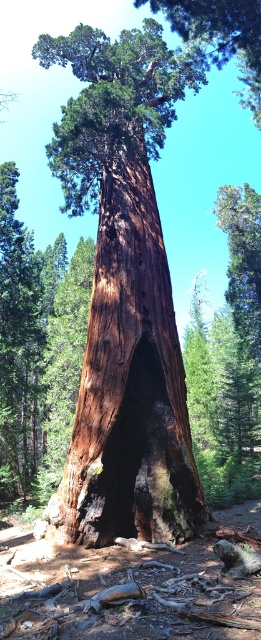
Between brown rough bark at center and smooth brown bark at upper center, which one is positioned higher?

smooth brown bark at upper center

Measure the distance between point (108, 400) and camera.

A distance of 7.70 meters exists between point (108, 400) and camera.

You are a GUI agent. You are given a task and a screenshot of the screen. Output one action in this format:
    pyautogui.click(x=<x>, y=<y>)
    Task: Click on the brown rough bark at center
    The width and height of the screenshot is (261, 640).
    Given the screenshot: What is the action you would take?
    pyautogui.click(x=131, y=380)